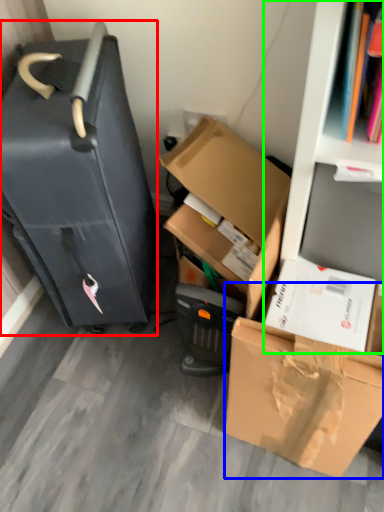
Question: Which object is the farthest from suitcase (highlighted by a red box)? Choose among these: box (highlighted by a blue box) or bookshelf (highlighted by a green box).

Choices:
 (A) box
 (B) bookshelf

Answer: (A)